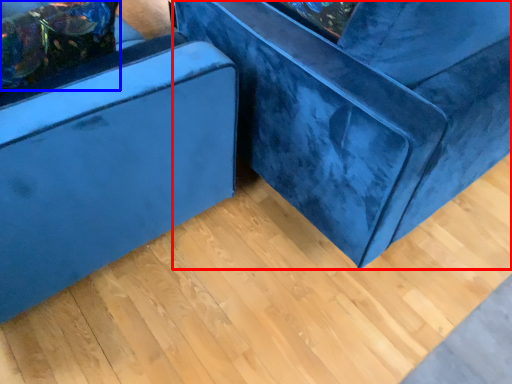
Question: Which point is further to the camera, furniture (highlighted by a red box) or pillow (highlighted by a blue box)?

Choices:
 (A) furniture
 (B) pillow

Answer: (B)